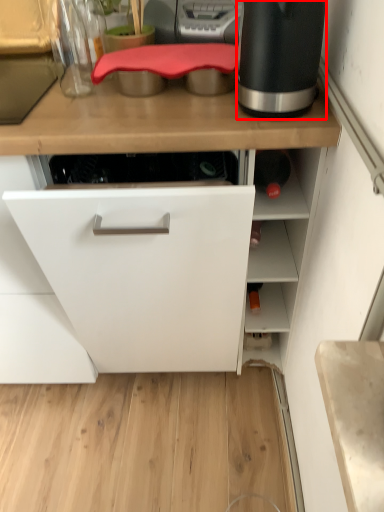
Question: From the image's perspective, what is the correct spatial relationship of home appliance (annotated by the red box) in relation to kitchen appliance?

Choices:
 (A) below
 (B) above

Answer: (A)